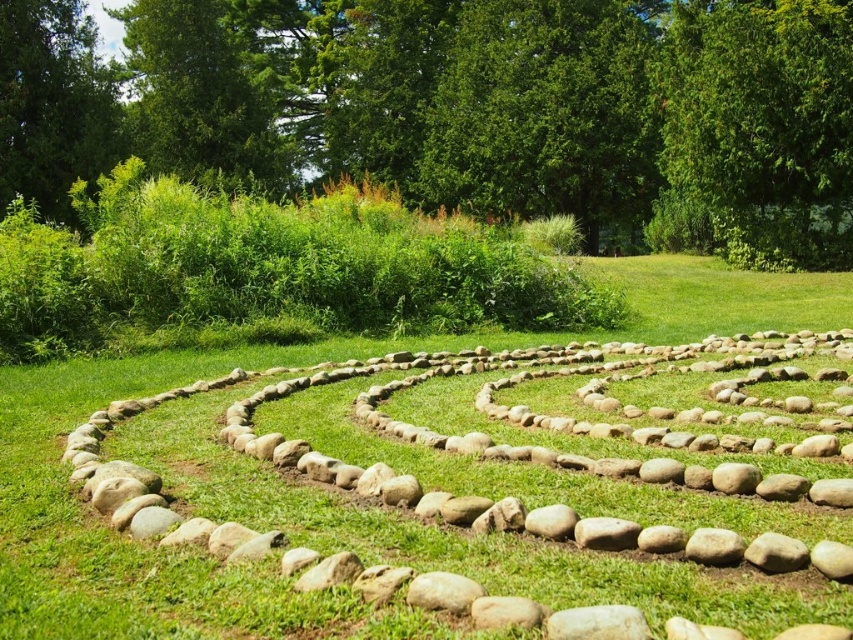
Question: Which object is the farthest from the smooth gray rock at center?

Choices:
 (A) smooth gray rock at lower right
 (B) natural stone at center

Answer: (B)

Question: Which point appears farthest from the camera in this image?

Choices:
 (A) (212, 429)
 (B) (469, 580)
 (C) (766, 540)

Answer: (A)

Question: Which object is farther from the camera taking this photo?

Choices:
 (A) smooth gray rock at lower right
 (B) smooth gray rock at center
 (C) natural stone at center

Answer: (A)

Question: Is smooth gray rock at center smaller than smooth gray rock at lower right?

Choices:
 (A) yes
 (B) no

Answer: (A)

Question: Where is smooth gray rock at center located in relation to smooth gray rock at lower right in the image?

Choices:
 (A) below
 (B) above

Answer: (A)

Question: Observing the image, what is the correct spatial positioning of natural stone at center in reference to smooth gray rock at center?

Choices:
 (A) left
 (B) right

Answer: (B)